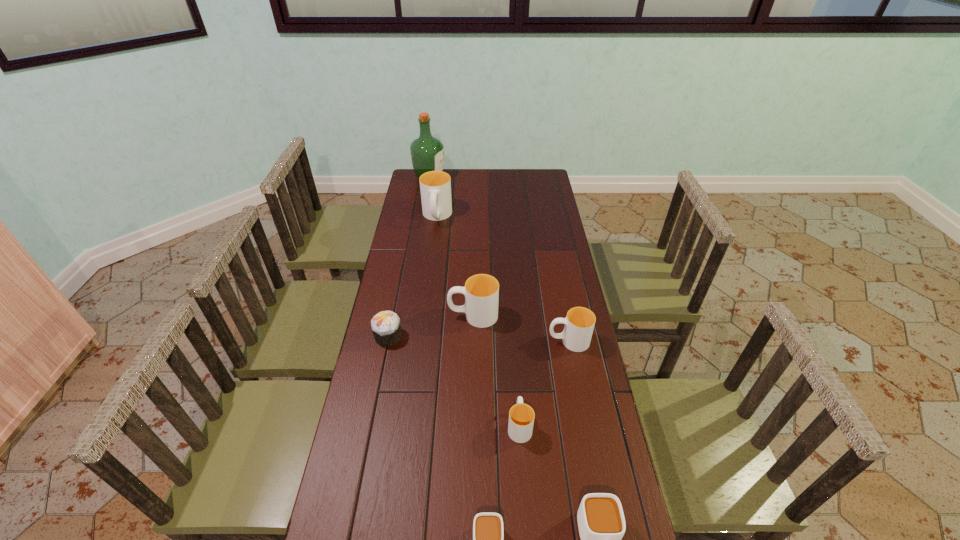
In the image, there is a desktop. Where is `vacant space at the left edge`? Image resolution: width=960 pixels, height=540 pixels. vacant space at the left edge is located at coordinates (375, 457).

At what (x,y) coordinates should I click in order to perform the action: click on vacant area at the right edge of the desktop. Please return your answer as a coordinate pair (x, y). Looking at the image, I should click on (558, 234).

The width and height of the screenshot is (960, 540). In the image, there is a desktop. Find the location of `vacant area at the far right corner`. vacant area at the far right corner is located at coordinates (528, 177).

Locate an element on the screen. The height and width of the screenshot is (540, 960). vacant area between the leftmost yellow cup and the third biggest yellow cup is located at coordinates (503, 279).

The width and height of the screenshot is (960, 540). I want to click on free space between the biggest yellow cup and the second nearest yellow cup, so pos(503,279).

You are a GUI agent. You are given a task and a screenshot of the screen. Output one action in this format:
    pyautogui.click(x=<x>, y=<y>)
    Task: Click on the vacant space in between the fourth nearest cup and the farthest yellow cup
    This screenshot has width=960, height=540.
    Given the screenshot: What is the action you would take?
    pyautogui.click(x=503, y=279)

Find the location of a particular element. This screenshot has width=960, height=540. vacant area that lies between the fourth tallest object and the tallest object is located at coordinates (499, 259).

You are a GUI agent. You are given a task and a screenshot of the screen. Output one action in this format:
    pyautogui.click(x=<x>, y=<y>)
    Task: Click on the object that can be found as the seventh closest to the leftmost yellow cup
    The height and width of the screenshot is (540, 960).
    Given the screenshot: What is the action you would take?
    pyautogui.click(x=601, y=522)

The image size is (960, 540). What are the coordinates of `object that is the second closest to the shortest object` in the screenshot? It's located at (521, 416).

What are the coordinates of `cup identified as the third closest to the tallest object` in the screenshot? It's located at (579, 323).